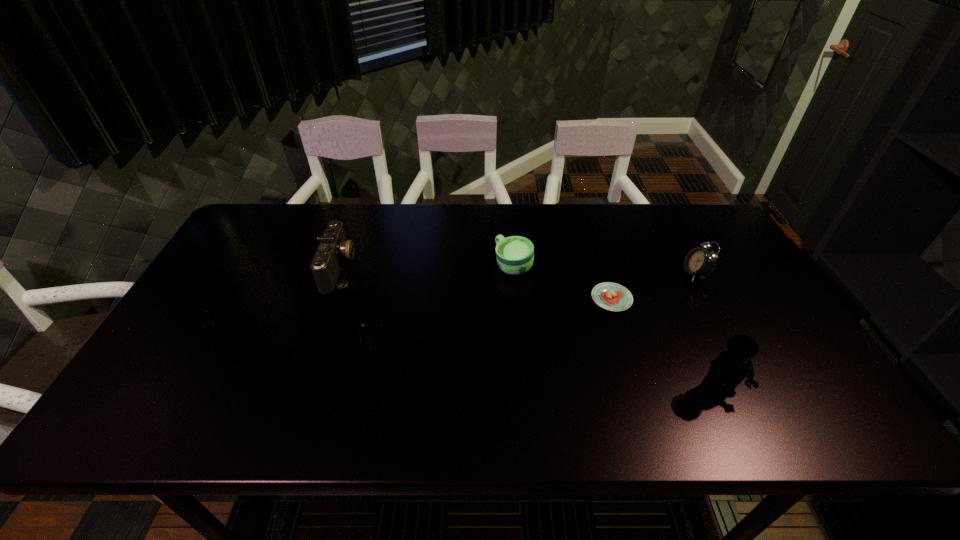
Where is `free space between the shortest object and the cup`? This screenshot has height=540, width=960. free space between the shortest object and the cup is located at coordinates (563, 282).

I want to click on vacant region between the leftmost object and the rightmost Lego, so click(x=468, y=361).

I want to click on free space between the nearest object and the second tallest object, so click(x=545, y=370).

Find the location of a particular element. The width and height of the screenshot is (960, 540). vacant area that lies between the sixth tallest object and the sixth shortest object is located at coordinates (443, 308).

The width and height of the screenshot is (960, 540). In order to click on empty space that is in between the sixth object from left to right and the leftmost object in this screenshot , I will do `click(468, 361)`.

Where is `free space between the shortest Lego and the rightmost Lego`? free space between the shortest Lego and the rightmost Lego is located at coordinates click(x=468, y=361).

Identify the location of free spot between the fourth object from left to right and the shortest Lego. (367, 299).

Choose which object is the second nearest neighbor to the nearest object. Please provide its 2D coordinates. Your answer should be formatted as a tuple, i.e. [(x, y)], where the tuple contains the x and y coordinates of a point satisfying the conditions above.

[(699, 262)]

Locate an element on the screen. This screenshot has height=540, width=960. object that is the fourth nearest to the cup is located at coordinates (699, 262).

Choose which Lego is the nearest neighbor to the sixth tallest object. Please provide its 2D coordinates. Your answer should be formatted as a tuple, i.e. [(x, y)], where the tuple contains the x and y coordinates of a point satisfying the conditions above.

[(360, 314)]